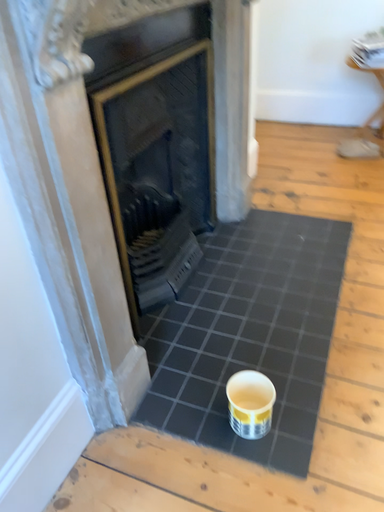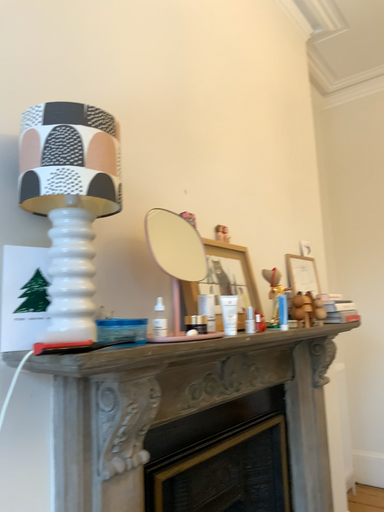
Question: Which way did the camera rotate in the video?

Choices:
 (A) rotated upward
 (B) rotated downward

Answer: (A)